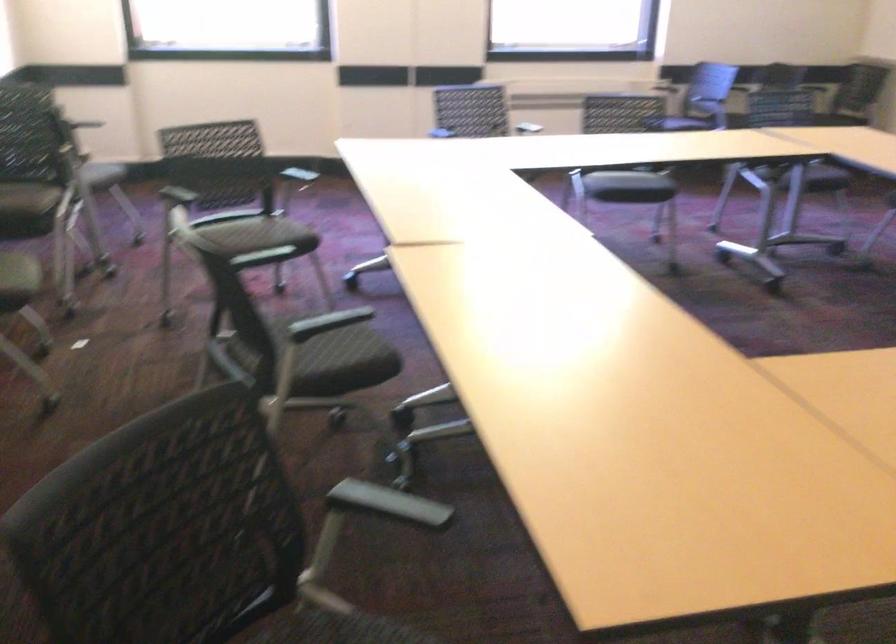
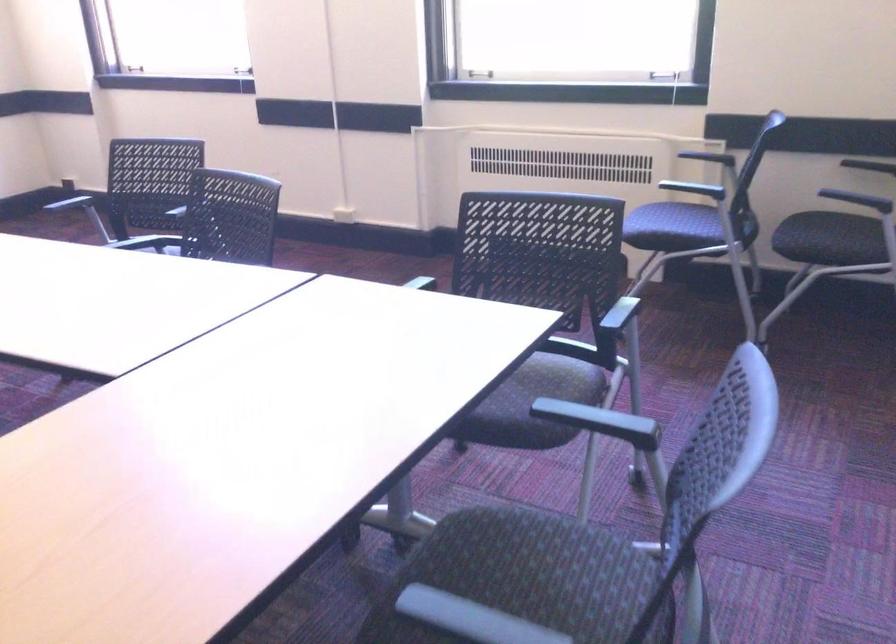
In the second image, find the point that corresponds to (x=677, y=109) in the first image.

(662, 220)